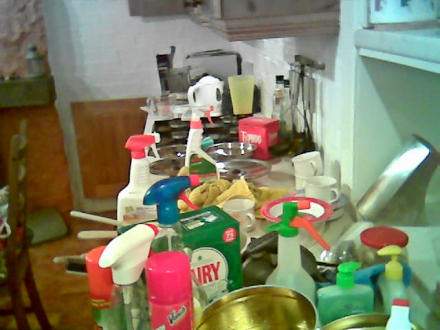
Where is `wall`? The height and width of the screenshot is (330, 440). wall is located at coordinates (130, 79).